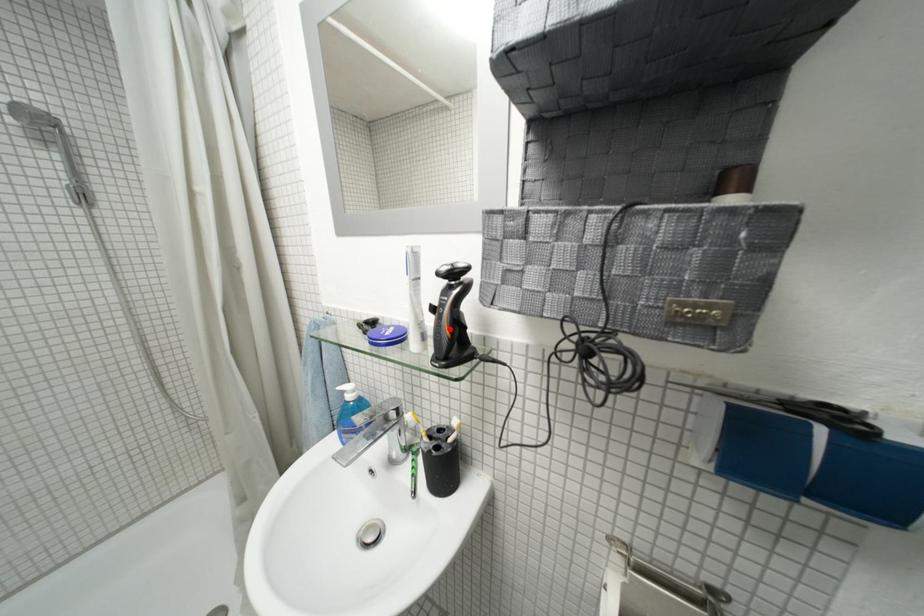
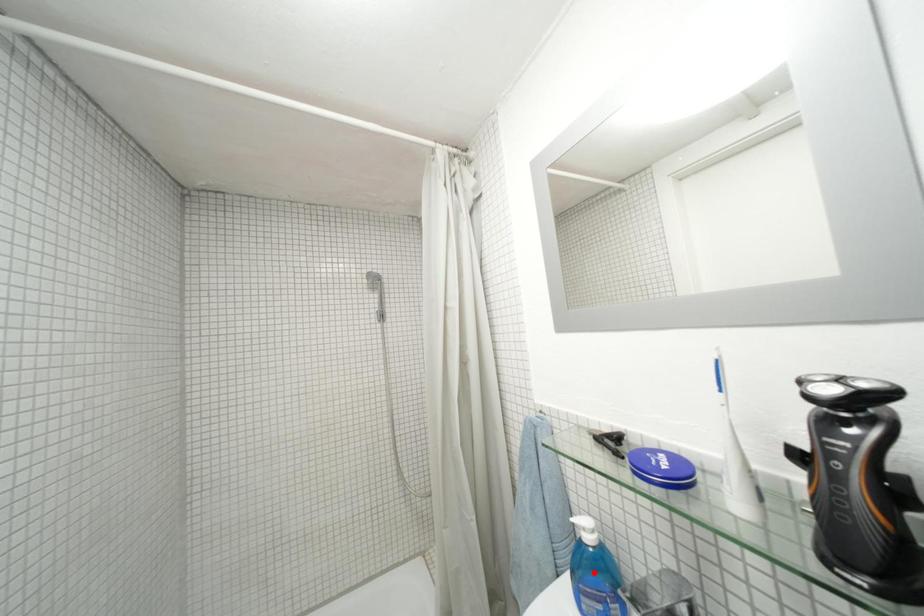
I am providing you with two images of the same scene from different viewpoints. A red point is marked on the first image and another point is marked on the second image. Do the highlighted points in image1 and image2 indicate the same real-world spot?

No